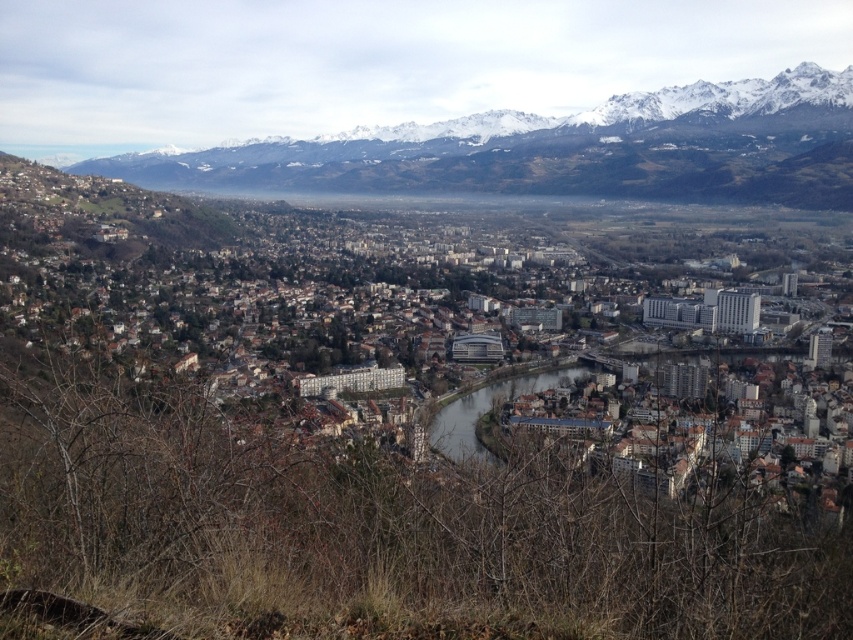
You are a drone operator planning to fly a drone from the snowy mountain range at upper center to the brown concrete river at center. What is the approximate distance you need to cover between these two landmarks?

The distance between the snowy mountain range at upper center and the brown concrete river at center is approximately 185.59 meters.

Consider the image. You are an urban planner reviewing this city layout. You need to determine the spatial relationship between the snowy mountain range at upper center and the brown concrete river at center. Which one is closer to the viewer?

The snowy mountain range at upper center is closer to the viewer than the brown concrete river at center because the river is positioned behind the mountain range.